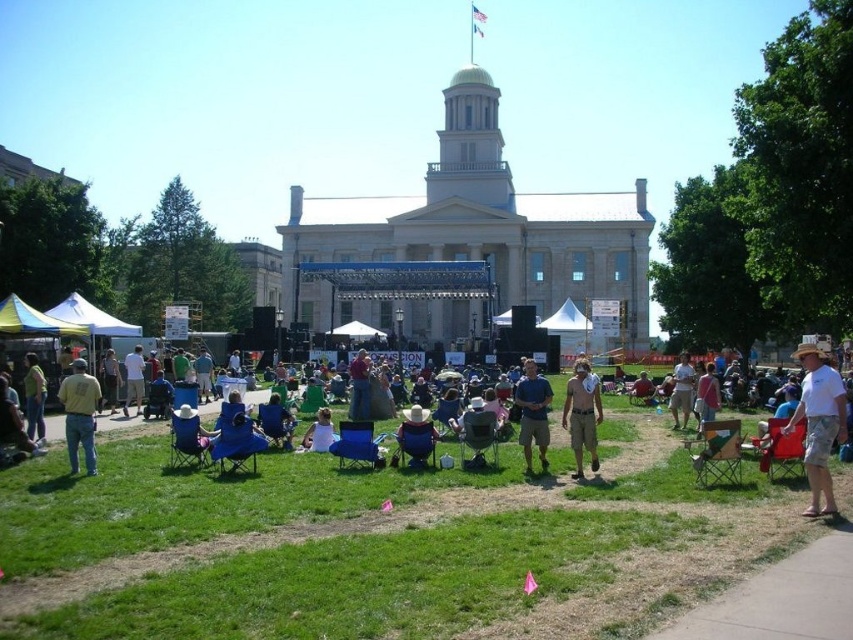
Question: Is light blue denim jeans at lower left to the right of light brown shorts at center from the viewer's perspective?

Choices:
 (A) no
 (B) yes

Answer: (A)

Question: Is denim jeans at center positioned at the back of light brown leather jacket at center?

Choices:
 (A) yes
 (B) no

Answer: (A)

Question: Is yellow cotton shirt at lower left to the left of brown leather belt at center from the viewer's perspective?

Choices:
 (A) yes
 (B) no

Answer: (A)

Question: Which object appears closest to the camera in this image?

Choices:
 (A) blue denim shorts at center
 (B) white cotton shirt at center

Answer: (A)

Question: Among these objects, which one is nearest to the camera?

Choices:
 (A) light blue denim jeans at lower left
 (B) white cotton shirt at center
 (C) denim jeans at center

Answer: (B)

Question: Which point appears closest to the camera in this image?

Choices:
 (A) (692, 372)
 (B) (531, 362)
 (C) (514, 515)

Answer: (C)